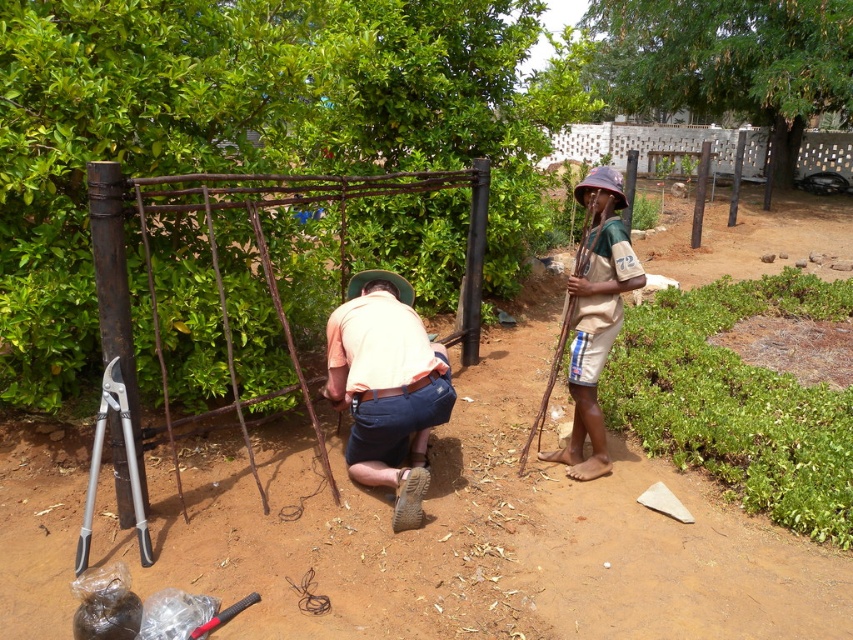
Is brown fabric hat at right positioned at the back of white brick fence at upper center?

No, it is in front of white brick fence at upper center.

Can you confirm if brown fabric hat at right is thinner than white brick fence at upper center?

Correct, brown fabric hat at right's width is less than white brick fence at upper center's.

Who is more forward, (589, 280) or (764, 154)?

Point (589, 280) is more forward.

You are a GUI agent. You are given a task and a screenshot of the screen. Output one action in this format:
    pyautogui.click(x=<x>, y=<y>)
    Task: Click on the brown fabric hat at right
    This screenshot has height=640, width=853.
    Given the screenshot: What is the action you would take?
    [x=596, y=317]

Describe the element at coordinates (387, 388) in the screenshot. This screenshot has height=640, width=853. I see `light orange cotton shirt at center` at that location.

Between point (363, 388) and point (567, 144), which one is positioned behind?

The point (567, 144) is behind.

Does point (440, 410) lie behind point (717, 141)?

No, it is in front of (717, 141).

Find the location of a particular element. Image resolution: width=853 pixels, height=640 pixels. light orange cotton shirt at center is located at coordinates (387, 388).

Does brown dirt field at center appear over white brick fence at upper center?

No, brown dirt field at center is not above white brick fence at upper center.

Is brown dirt field at center closer to the viewer compared to white brick fence at upper center?

That is True.

Between point (844, 557) and point (569, 152), which one is positioned in front?

Point (844, 557) is more forward.

Where is `brown dirt field at center`? The width and height of the screenshot is (853, 640). brown dirt field at center is located at coordinates (477, 532).